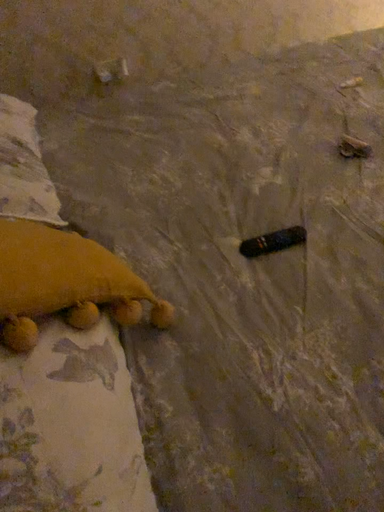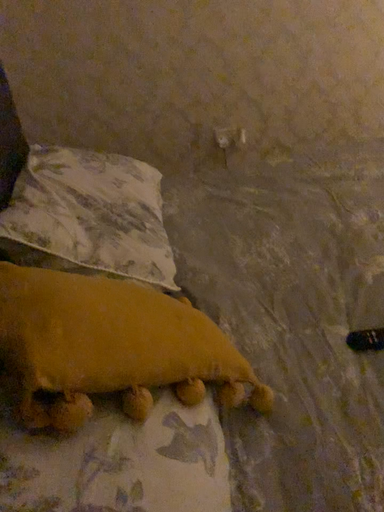
Question: How did the camera likely rotate when shooting the video?

Choices:
 (A) rotated upward
 (B) rotated downward

Answer: (A)